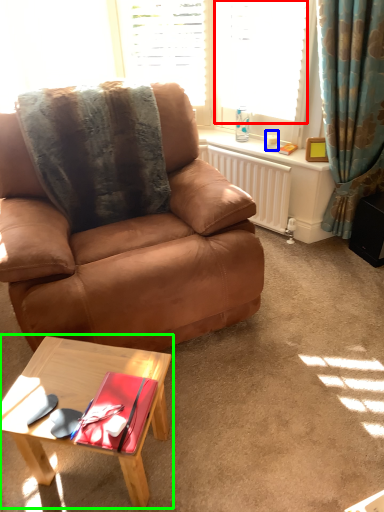
Question: Considering the real-world distances, which object is closest to window (highlighted by a red box)? coffee cup (highlighted by a blue box) or coffee table (highlighted by a green box).

Choices:
 (A) coffee cup
 (B) coffee table

Answer: (A)